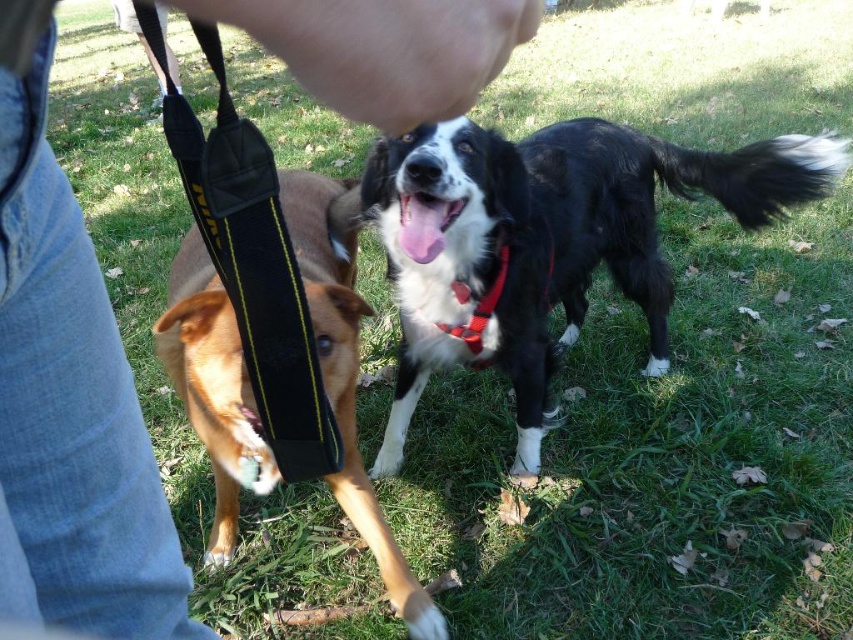
Question: Does jeans at lower left have a smaller size compared to pink rubber dog mouth at center?

Choices:
 (A) yes
 (B) no

Answer: (B)

Question: Which of the following is the farthest from the observer?

Choices:
 (A) (422, 252)
 (B) (256, 252)
 (C) (466, 346)
 (D) (538, 269)

Answer: (D)

Question: Which point is farther from the camera taking this photo?

Choices:
 (A) (463, 284)
 (B) (258, 177)
 (C) (444, 225)
 (D) (210, 388)

Answer: (A)

Question: Is brown fur dog at lower left further to camera compared to red fabric neckband at center?

Choices:
 (A) yes
 (B) no

Answer: (B)

Question: Among these points, which one is farthest from the camera?

Choices:
 (A) pyautogui.click(x=357, y=33)
 (B) pyautogui.click(x=277, y=282)
 (C) pyautogui.click(x=401, y=348)

Answer: (C)

Question: Can you confirm if black matte dog at center is positioned to the left of pink rubber dog mouth at center?

Choices:
 (A) no
 (B) yes

Answer: (A)